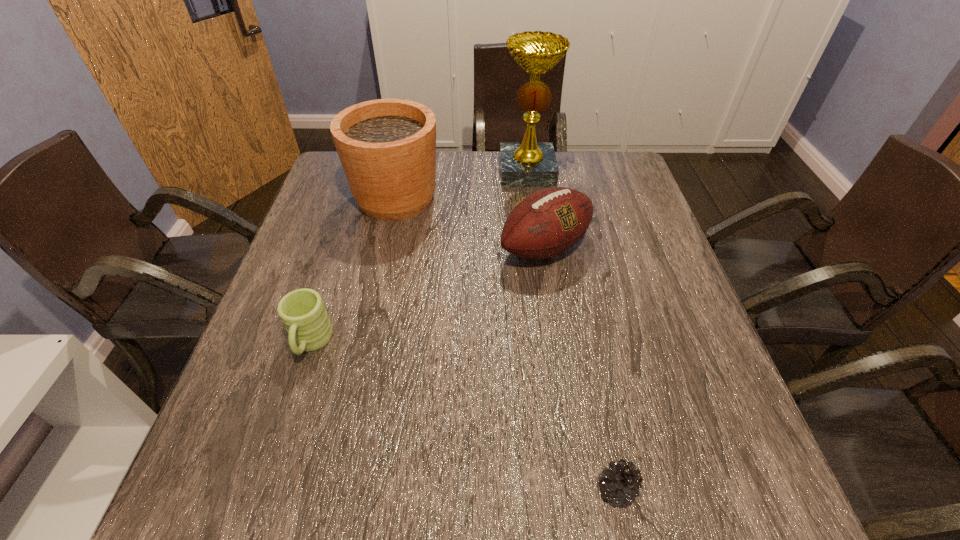
The image size is (960, 540). I want to click on free region at the far right corner, so click(585, 189).

Where is `vacant region between the pinecone and the flowerpot`? vacant region between the pinecone and the flowerpot is located at coordinates (506, 344).

Find the location of a particular element. free space between the pinecone and the football (American) is located at coordinates pos(581,368).

Identify the location of free space between the shortest object and the tallest object. (571, 330).

Find the location of a particular element. The image size is (960, 540). free area in between the fourth shortest object and the mug is located at coordinates point(353,271).

Identify the location of blank region between the pinecone and the award. (571, 330).

Locate an element on the screen. Image resolution: width=960 pixels, height=540 pixels. free space between the mug and the fourth shortest object is located at coordinates (353, 271).

I want to click on empty space between the nearest object and the flowerpot, so click(506, 344).

Where is `free spot between the third shortest object and the nearest object`? Image resolution: width=960 pixels, height=540 pixels. free spot between the third shortest object and the nearest object is located at coordinates (581, 368).

Locate an element on the screen. vacant region between the second nearest object and the award is located at coordinates (419, 258).